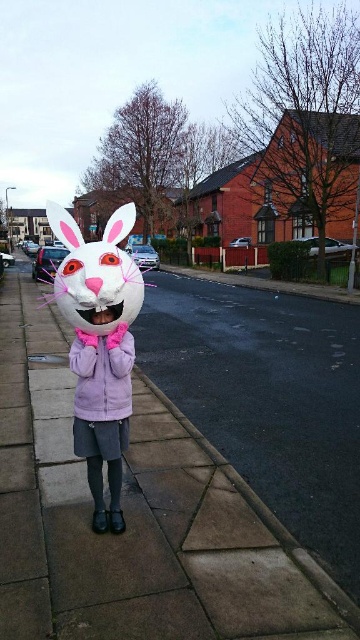
Does point (165, 614) lie behind point (83, 285)?

No, it is in front of (83, 285).

Is point (173, 506) closer to viewer compared to point (122, 240)?

No, (173, 506) is further to viewer.

Identify the location of matte concrete pavement at center. The height and width of the screenshot is (640, 360). (135, 518).

Who is more forward, (155,552) or (119,308)?

Point (119,308)

Between matte concrete pavement at center and matte white bunny mask at center, which one is positioned higher?

matte white bunny mask at center

Measure the distance between point [155,620] and camera.

They are 7.70 feet apart.

Locate an element on the screen. The height and width of the screenshot is (640, 360). matte concrete pavement at center is located at coordinates (135, 518).

Which of these two, matte white bunny mask at center or purple fleece jacket at center, stands taller?

matte white bunny mask at center

You are a GUI agent. You are given a task and a screenshot of the screen. Output one action in this format:
    pyautogui.click(x=<x>, y=<y>)
    Task: Click on the matte white bunny mask at center
    
    Given the screenshot: What is the action you would take?
    pyautogui.click(x=100, y=346)